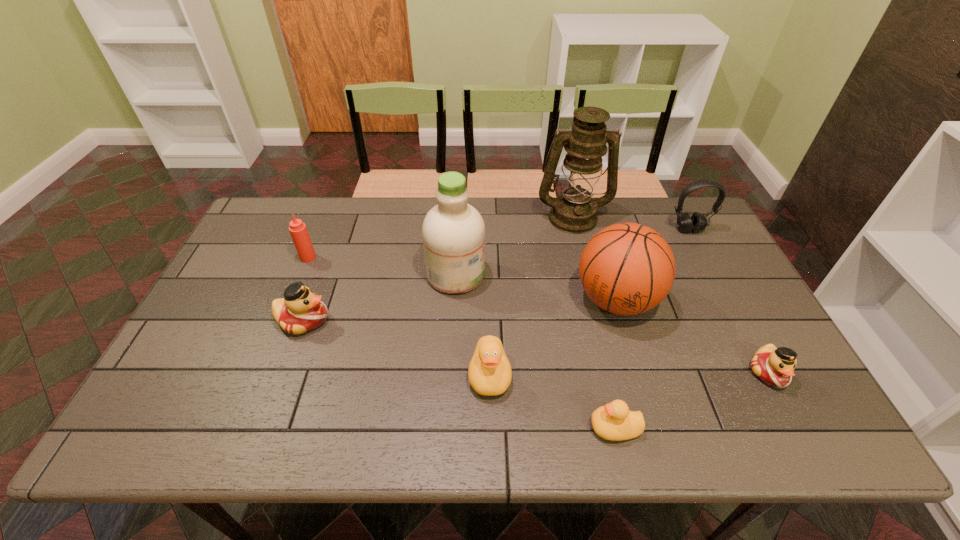
Where is `free space located 0.060m on the face of the left yellow duck`? free space located 0.060m on the face of the left yellow duck is located at coordinates coord(491,426).

At what (x,y) coordinates should I click in order to perform the action: click on blank space located 0.100m on the face of the nearer red duck. Please return your answer as a coordinate pair (x, y). Looking at the image, I should click on (801, 433).

Find the location of a particular element. This screenshot has width=960, height=540. free space located on the face of the right yellow duck is located at coordinates (504, 428).

Identify the location of free spot located on the face of the right yellow duck. Image resolution: width=960 pixels, height=540 pixels. (500, 428).

Locate an element on the screen. vacant space located 0.150m on the face of the right yellow duck is located at coordinates (522, 428).

Where is `oil lamp positioned at the far edge`? Image resolution: width=960 pixels, height=540 pixels. oil lamp positioned at the far edge is located at coordinates (574, 211).

Find the location of a particular element. This screenshot has height=540, width=960. headset situated at the far edge is located at coordinates (697, 222).

Identify the location of object that is at the near edge. Image resolution: width=960 pixels, height=540 pixels. click(614, 421).

Where is `headset present at the right edge`? The width and height of the screenshot is (960, 540). headset present at the right edge is located at coordinates (697, 222).

Find the location of a particular element. duck that is at the right edge is located at coordinates (774, 366).